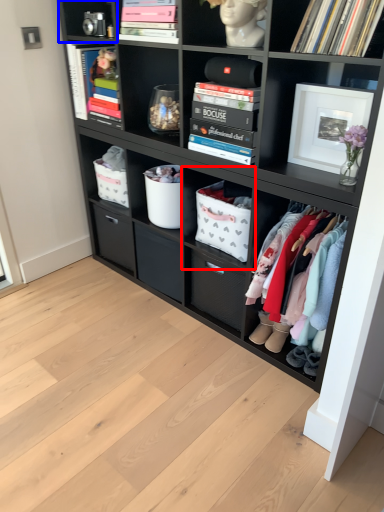
Question: Which point is further to the camera, shelf (highlighted by a red box) or cabinet (highlighted by a blue box)?

Choices:
 (A) shelf
 (B) cabinet

Answer: (B)